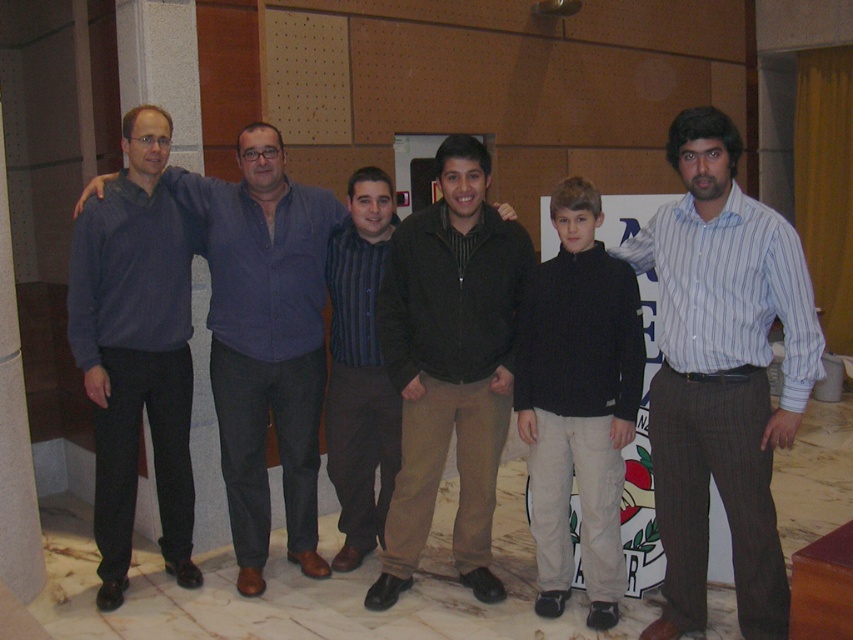
Does point (795, 422) come closer to viewer compared to point (490, 572)?

Yes, point (795, 422) is closer to viewer.

Is point (668, 538) more distant than point (485, 273)?

No, (668, 538) is closer to viewer.

Who is more forward, (704, 168) or (498, 380)?

Point (704, 168)

I want to click on blue striped shirt at center, so click(x=722, y=374).

Who is more distant from viewer, (82, 212) or (294, 218)?

The point (294, 218) is more distant.

Is matte blue sweater at left wider than matte blue shirt at center?

Incorrect, matte blue sweater at left's width does not surpass matte blue shirt at center's.

You are a GUI agent. You are given a task and a screenshot of the screen. Output one action in this format:
    pyautogui.click(x=<x>, y=<y>)
    Task: Click on the matte blue sweater at left
    
    Given the screenshot: What is the action you would take?
    pyautogui.click(x=135, y=349)

Where is `matte blue sweater at left`? matte blue sweater at left is located at coordinates (135, 349).

Is blue striped shirt at center thinner than black fleece jacket at center?

Incorrect, blue striped shirt at center's width is not less than black fleece jacket at center's.

Can you confirm if blue striped shirt at center is smaller than black fleece jacket at center?

No.

Between point (706, 230) and point (582, 364), which one is positioned behind?

The point (582, 364) is behind.

Locate an element on the screen. This screenshot has width=853, height=640. blue striped shirt at center is located at coordinates (722, 374).